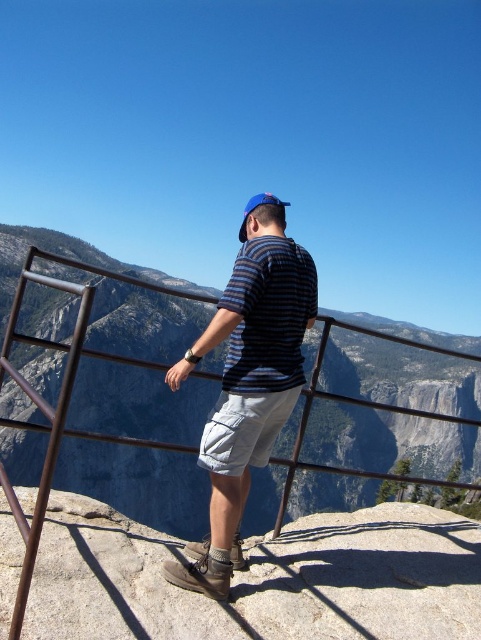
You are a fashion designer analyzing clothing sizes in the image. The striped fabric shirt at center and white cotton shorts at center are both worn by the same person. Which clothing item appears to be the larger size?

The striped fabric shirt at center is larger in size than the white cotton shorts at center.

You are a photographer planning to take a portrait of the person wearing the striped fabric shirt at center. To ensure the shirt is in the frame, where should you position your camera relative to the person?

The striped fabric shirt at center is located at point (248, 385), so you should position your camera so that the center of the frame aligns with this coordinate to ensure the shirt is centered in the photo.

You are a fashion designer analyzing clothing items in the image. The striped fabric shirt at center and blue fabric baseball cap at upper center are both in view. Which clothing item has a smaller width?

The striped fabric shirt at center is thinner than the blue fabric baseball cap at upper center, so the striped fabric shirt at center has a smaller width.